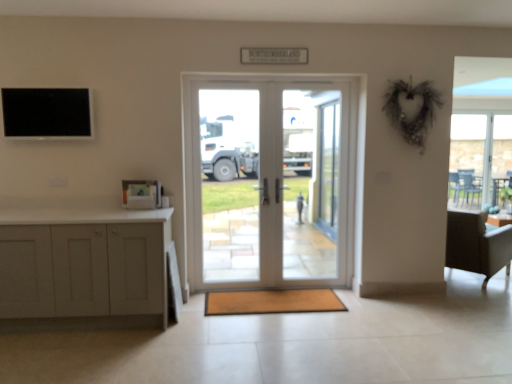
Where is `free space above transparent glass door at center, the first screen door in the left-to-right sequence (from a real-world perspective)`? free space above transparent glass door at center, the first screen door in the left-to-right sequence (from a real-world perspective) is located at coordinates (312, 80).